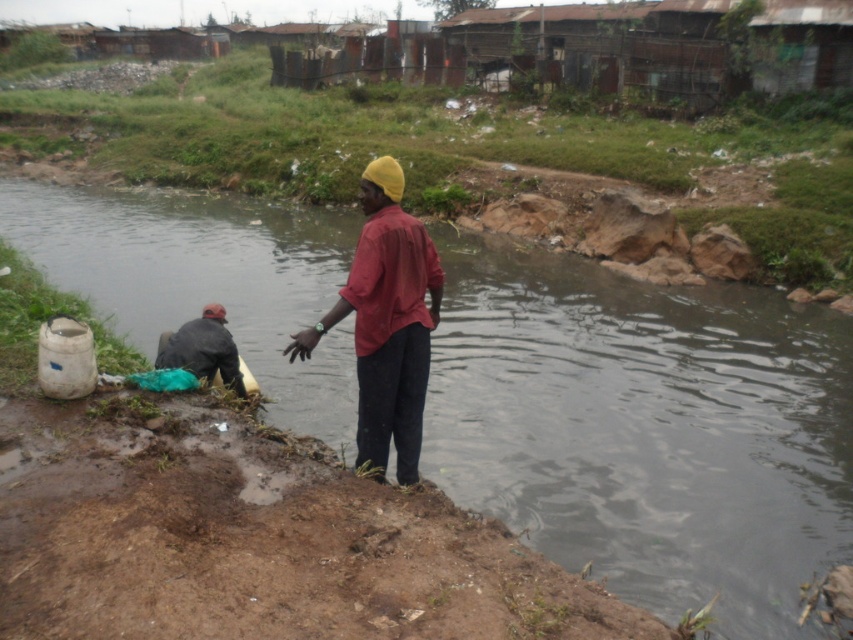
Question: Which point is closer to the camera?

Choices:
 (A) dark gray fabric at lower left
 (B) brown muddy stream at center

Answer: (B)

Question: Among these objects, which one is nearest to the camera?

Choices:
 (A) dark gray fabric at lower left
 (B) brown muddy stream at center

Answer: (B)

Question: Can you confirm if matte red shirt at center is thinner than dark gray fabric at lower left?

Choices:
 (A) yes
 (B) no

Answer: (A)

Question: Which object appears farthest from the camera in this image?

Choices:
 (A) brown muddy stream at center
 (B) dark gray fabric at lower left

Answer: (B)

Question: Is brown muddy stream at center closer to camera compared to dark gray fabric at lower left?

Choices:
 (A) yes
 (B) no

Answer: (A)

Question: Does matte red shirt at center appear over dark gray fabric at lower left?

Choices:
 (A) no
 (B) yes

Answer: (B)